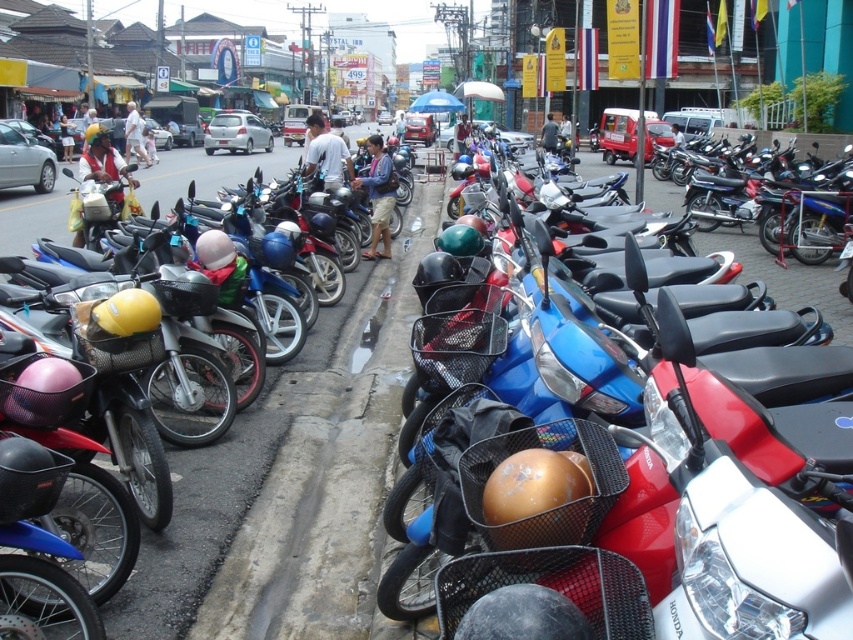
Question: Does blue glossy motorcycle at center appear under matte blue helmet at center?

Choices:
 (A) yes
 (B) no

Answer: (B)

Question: Which point is closer to the camera?

Choices:
 (A) (712, 326)
 (B) (363, 252)

Answer: (A)

Question: Which object is closer to the camera taking this photo?

Choices:
 (A) matte blue helmet at center
 (B) blue glossy motorcycle at center

Answer: (B)

Question: Does blue glossy motorcycle at center have a larger size compared to matte blue helmet at center?

Choices:
 (A) no
 (B) yes

Answer: (B)

Question: Can you confirm if blue glossy motorcycle at center is thinner than matte blue helmet at center?

Choices:
 (A) no
 (B) yes

Answer: (A)